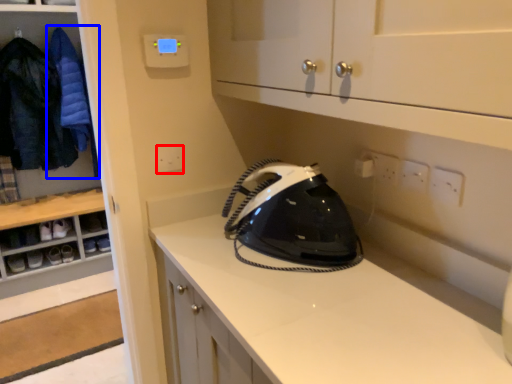
Question: Among these objects, which one is farthest to the camera, electric outlet (highlighted by a red box) or clothing (highlighted by a blue box)?

Choices:
 (A) electric outlet
 (B) clothing

Answer: (B)